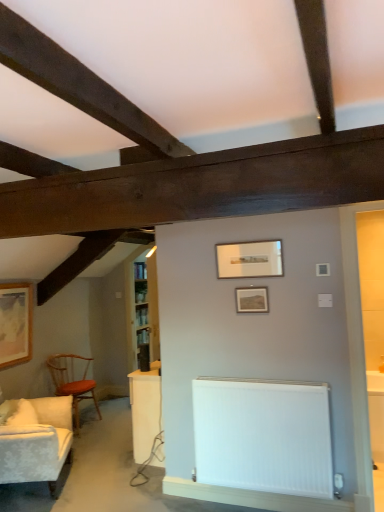
Question: Looking at the image, does matte wooden picture frame at center, positioned as the 2th picture frame in back-to-front order, seem bigger or smaller compared to wooden polished chair at left?

Choices:
 (A) small
 (B) big

Answer: (A)

Question: Is matte wooden picture frame at center, arranged as the 2th picture frame when ordered from the bottom, inside the boundaries of wooden polished chair at left, or outside?

Choices:
 (A) inside
 (B) outside

Answer: (B)

Question: Which is nearer to the white glossy table at lower right?

Choices:
 (A) wooden framed picture at left, positioned as the third picture frame in top-to-bottom order
 (B) white smooth radiator at lower center
 (C) white textured fabric couch at left
 (D) matte silver picture frame at center, the 1th picture frame from the top
 (E) matte wooden picture frame at center, positioned as the 2th picture frame in back-to-front order

Answer: (B)

Question: Which is nearer to the wooden polished chair at left?

Choices:
 (A) matte silver picture frame at center, the 3th picture frame ordered from the bottom
 (B) white smooth radiator at lower center
 (C) white textured fabric couch at left
 (D) white glossy table at lower right
 (E) matte wooden picture frame at center, which is the second picture frame in front-to-back order

Answer: (C)